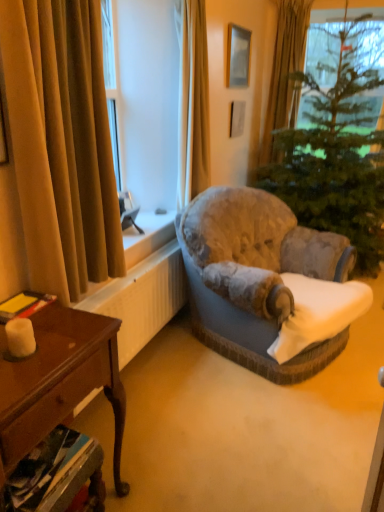
Image resolution: width=384 pixels, height=512 pixels. Identify the location of vacant space in front of white matte candle at lower left. (17, 378).